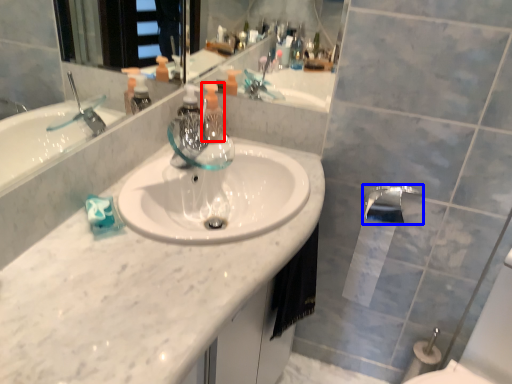
Question: Among these objects, which one is farthest to the camera, soap dispenser (highlighted by a red box) or tap (highlighted by a blue box)?

Choices:
 (A) soap dispenser
 (B) tap

Answer: (A)